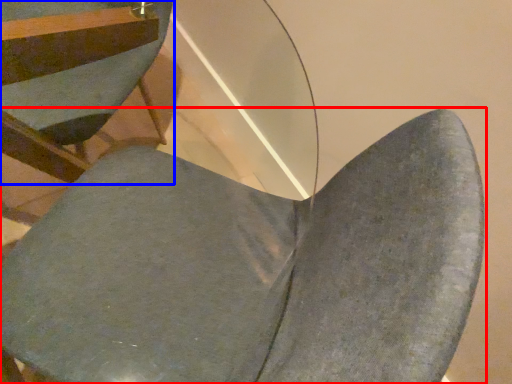
Question: Which point is closer to the camera, chair (highlighted by a red box) or chair (highlighted by a blue box)?

Choices:
 (A) chair
 (B) chair

Answer: (A)